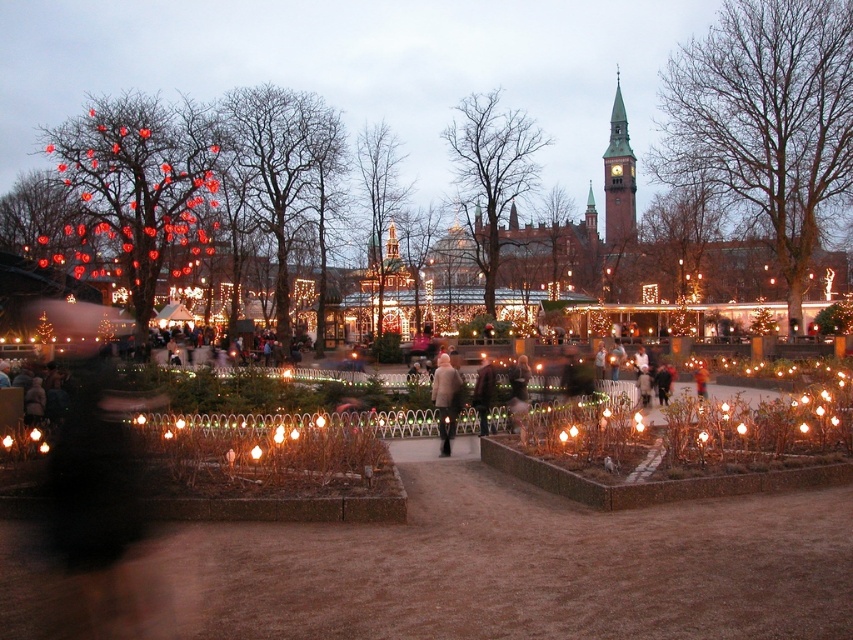
Question: Which point is farther from the camera taking this photo?

Choices:
 (A) (294, 116)
 (B) (534, 144)

Answer: (B)

Question: Does smooth brown tree at center have a greater width compared to smooth green tree at center?

Choices:
 (A) yes
 (B) no

Answer: (A)

Question: Among these objects, which one is farthest from the camera?

Choices:
 (A) smooth bark tree at center
 (B) shiny gold tinsel at center
 (C) smooth green tree at center

Answer: (C)

Question: Which point appears farthest from the camera in this image?

Choices:
 (A) (700, 131)
 (B) (451, 378)
 (C) (698, 266)

Answer: (C)

Question: Can you confirm if smooth brown tree at center is positioned below shiny gold tinsel at center?

Choices:
 (A) no
 (B) yes

Answer: (B)

Question: Can you confirm if bare branches at upper center is thinner than smooth brown tree at center?

Choices:
 (A) no
 (B) yes

Answer: (A)